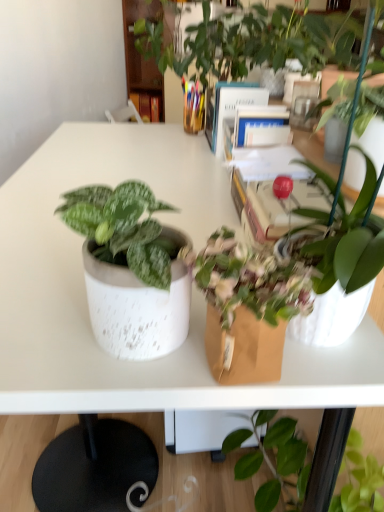
Question: From a real-world perspective, does hardcover book at center, the third book positioned from the back, stand above hardcover book at center, acting as the 3th book starting from the bottom?

Choices:
 (A) no
 (B) yes

Answer: (B)

Question: Does hardcover book at center, marked as the 3th book in a top-to-bottom arrangement, have a greater width compared to hardcover book at center, the third book viewed from the right?

Choices:
 (A) yes
 (B) no

Answer: (A)

Question: Does hardcover book at center, the third book positioned from the back, have a greater height compared to hardcover book at center, the third book viewed from the right?

Choices:
 (A) no
 (B) yes

Answer: (A)

Question: Does hardcover book at center, which appears as the 1th book when viewed from the right, turn towards hardcover book at center, the third book viewed from the right?

Choices:
 (A) yes
 (B) no

Answer: (B)

Question: Is hardcover book at center, which appears as the 1th book when viewed from the right, located outside hardcover book at center, marked as the first book in a top-to-bottom arrangement?

Choices:
 (A) no
 (B) yes

Answer: (B)

Question: Is hardcover book at center, which appears as the 1th book when viewed from the right, facing away from hardcover book at center, the third book viewed from the right?

Choices:
 (A) yes
 (B) no

Answer: (B)

Question: Would you say blue hardcover book at upper center, the 2th book from the top, is a long distance from hardcover book at center, which is counted as the 3th book, starting from the front?

Choices:
 (A) yes
 (B) no

Answer: (A)

Question: Can you see blue hardcover book at upper center, marked as the 2th book in a left-to-right arrangement, touching hardcover book at center, the third book viewed from the right?

Choices:
 (A) no
 (B) yes

Answer: (A)

Question: Is blue hardcover book at upper center, arranged as the second book when viewed from the right, thinner than hardcover book at center, which is counted as the 3th book, starting from the front?

Choices:
 (A) yes
 (B) no

Answer: (B)

Question: Is blue hardcover book at upper center, the second book when ordered from front to back, oriented away from hardcover book at center, which is counted as the 3th book, starting from the front?

Choices:
 (A) yes
 (B) no

Answer: (B)

Question: Is blue hardcover book at upper center, the second book when ordered from front to back, positioned in front of hardcover book at center, acting as the 3th book starting from the bottom?

Choices:
 (A) yes
 (B) no

Answer: (A)

Question: Does blue hardcover book at upper center, marked as the 2th book in a left-to-right arrangement, have a greater height compared to hardcover book at center, the first book viewed from the back?

Choices:
 (A) no
 (B) yes

Answer: (B)

Question: Is hardcover book at center, the first book viewed from the back, to the right of hardcover book at center, which appears as the 1th book when viewed from the right, from the viewer's perspective?

Choices:
 (A) yes
 (B) no

Answer: (B)